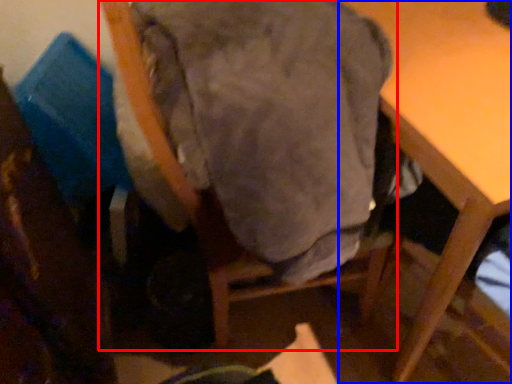
Question: Which object is closer to the camera taking this photo, chair (highlighted by a red box) or table (highlighted by a blue box)?

Choices:
 (A) chair
 (B) table

Answer: (A)